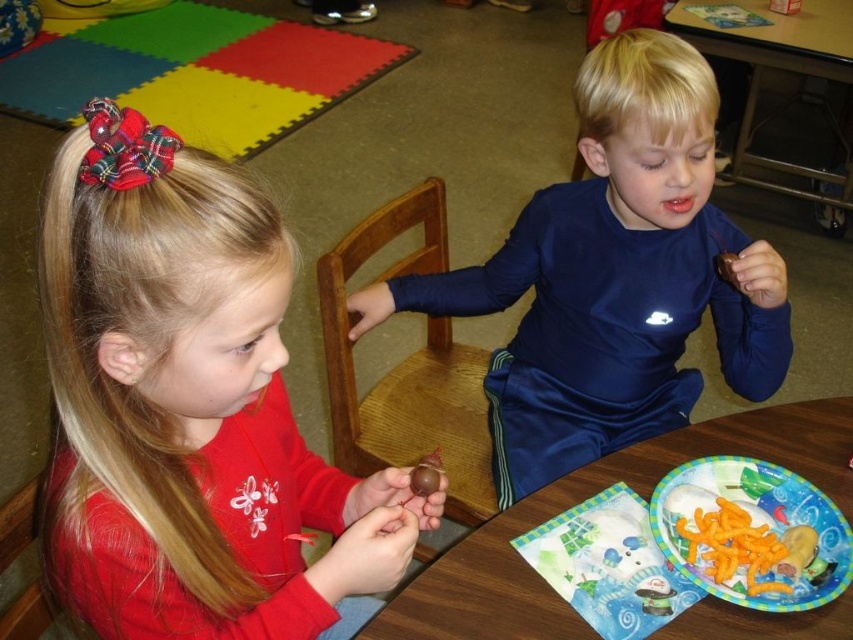
Question: Estimate the real-world distances between objects in this image. Which object is farther from the paper plate with colorful design at lower right?

Choices:
 (A) shiny blue shirt at center
 (B) wooden table at center
 (C) paper plate at lower center
 (D) matte red shirt at center

Answer: (B)

Question: Estimate the real-world distances between objects in this image. Which object is closer to the paper plate with colorful design at lower right?

Choices:
 (A) matte red shirt at center
 (B) shiny blue shirt at center
 (C) paper plate at lower center

Answer: (C)

Question: Does matte red shirt at center come behind paper plate with colorful design at lower right?

Choices:
 (A) yes
 (B) no

Answer: (B)

Question: Can you confirm if shiny blue shirt at center is positioned to the right of paper plate with colorful design at lower right?

Choices:
 (A) yes
 (B) no

Answer: (B)

Question: Which point is farther to the camera?

Choices:
 (A) tap(808, 20)
 (B) tap(496, 515)
 (C) tap(194, 150)
 (D) tap(619, 404)

Answer: (A)

Question: Does matte red shirt at center appear on the left side of wooden table at center?

Choices:
 (A) yes
 (B) no

Answer: (A)